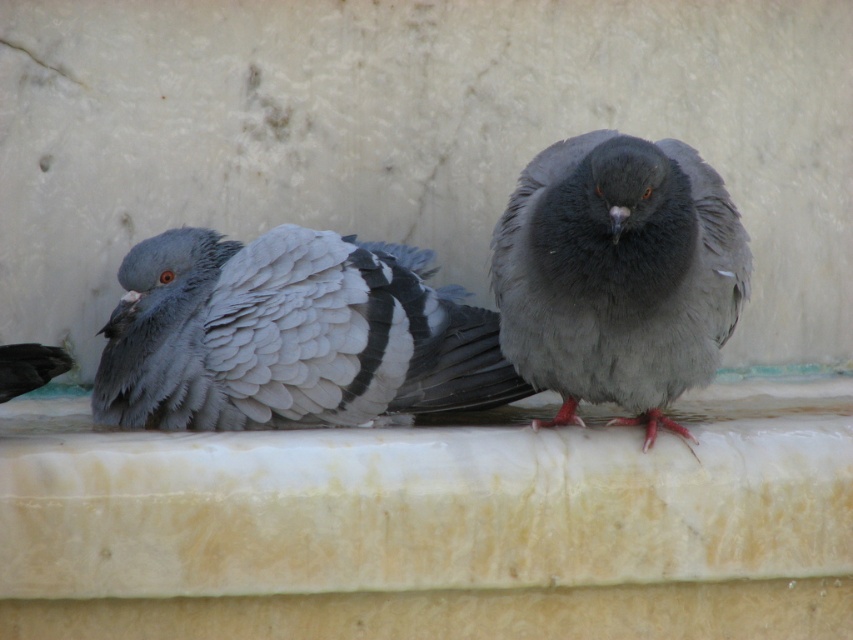
You are a birdwatcher observing two birds on a ledge. You notice the gray matte feathers at center and the gray matte pigeon at center. Which one is smaller in size?

The gray matte feathers at center is smaller than the gray matte pigeon at center.

You are a birdwatcher observing two pigeons on a marble ledge. You notice a gray matte pigeon at center and gray matte feathers at center. Which object is located below the other?

The gray matte feathers at center are positioned under the gray matte pigeon at center, so the feathers are below the pigeon.